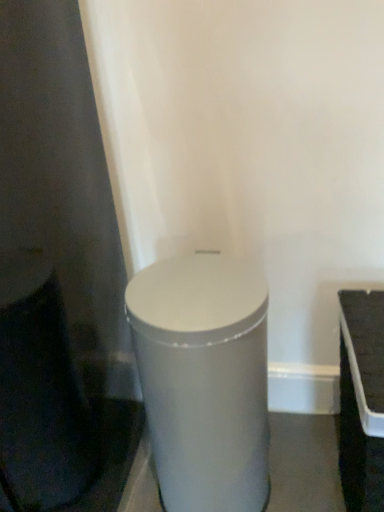
Locate an element on the screen. The height and width of the screenshot is (512, 384). satin silver cylinder at center is located at coordinates (204, 379).

This screenshot has height=512, width=384. Describe the element at coordinates (204, 379) in the screenshot. I see `satin silver cylinder at center` at that location.

The height and width of the screenshot is (512, 384). Describe the element at coordinates (362, 399) in the screenshot. I see `white plastic tray at right` at that location.

The image size is (384, 512). Find the location of `white plastic tray at right`. white plastic tray at right is located at coordinates (362, 399).

In order to face white plastic tray at right, should I rotate leftwards or rightwards?

To align with it, rotate right about 23.354°.

Where is `satin silver cylinder at center`? The image size is (384, 512). satin silver cylinder at center is located at coordinates (204, 379).

Can you confirm if white plastic tray at right is positioned to the left of satin silver cylinder at center?

No.

Is the position of white plastic tray at right less distant than that of satin silver cylinder at center?

Yes, the depth of white plastic tray at right is less than that of satin silver cylinder at center.

Is point (371, 297) farther from camera compared to point (207, 274)?

Yes.

From the image's perspective, is white plastic tray at right below satin silver cylinder at center?

Correct, white plastic tray at right appears lower than satin silver cylinder at center in the image.

From a real-world perspective, is white plastic tray at right physically above satin silver cylinder at center?

Incorrect, from a real-world perspective, white plastic tray at right is lower than satin silver cylinder at center.

From the picture: Considering the sizes of objects white plastic tray at right and satin silver cylinder at center in the image provided, who is thinner, white plastic tray at right or satin silver cylinder at center?

satin silver cylinder at center is thinner.

Considering the relative sizes of white plastic tray at right and satin silver cylinder at center in the image provided, is white plastic tray at right taller than satin silver cylinder at center?

Incorrect, the height of white plastic tray at right is not larger of that of satin silver cylinder at center.

Based on their sizes in the image, would you say white plastic tray at right is bigger or smaller than satin silver cylinder at center?

Considering their sizes, white plastic tray at right takes up less space than satin silver cylinder at center.

Is white plastic tray at right inside or outside of satin silver cylinder at center?

white plastic tray at right is spatially situated outside satin silver cylinder at center.

Is white plastic tray at right not close to satin silver cylinder at center?

No.

Is white plastic tray at right facing away from satin silver cylinder at center?

No, white plastic tray at right's orientation is not away from satin silver cylinder at center.

You are a GUI agent. You are given a task and a screenshot of the screen. Output one action in this format:
    pyautogui.click(x=<x>, y=<y>)
    Task: Click on the table that appears below the satin silver cylinder at center (from a real-world perspective)
    The width and height of the screenshot is (384, 512).
    Given the screenshot: What is the action you would take?
    pyautogui.click(x=362, y=399)

Looking at this image, would you say satin silver cylinder at center is to the left or to the right of white plastic tray at right in the picture?

From the image, it's evident that satin silver cylinder at center is to the left of white plastic tray at right.

Considering the positions of objects satin silver cylinder at center and white plastic tray at right in the image provided, who is behind, satin silver cylinder at center or white plastic tray at right?

satin silver cylinder at center is more distant.

Between point (144, 307) and point (356, 388), which one is positioned behind?

The point (144, 307) is farther from the camera.

From the image's perspective, does satin silver cylinder at center appear lower than white plastic tray at right?

No, from the image's perspective, satin silver cylinder at center is not beneath white plastic tray at right.

From a real-world perspective, who is located lower, satin silver cylinder at center or white plastic tray at right?

white plastic tray at right, from a real-world perspective.

Between satin silver cylinder at center and white plastic tray at right, which one has larger width?

white plastic tray at right.

Considering the relative sizes of satin silver cylinder at center and white plastic tray at right in the image provided, is satin silver cylinder at center shorter than white plastic tray at right?

In fact, satin silver cylinder at center may be taller than white plastic tray at right.

Considering the sizes of objects satin silver cylinder at center and white plastic tray at right in the image provided, who is smaller, satin silver cylinder at center or white plastic tray at right?

Smaller between the two is white plastic tray at right.

Can we say satin silver cylinder at center lies outside white plastic tray at right?

That's correct, satin silver cylinder at center is outside of white plastic tray at right.

Is satin silver cylinder at center next to white plastic tray at right and touching it?

No.

Based on the photo, could you tell me if satin silver cylinder at center is facing white plastic tray at right?

No, satin silver cylinder at center is not oriented towards white plastic tray at right.

Can you tell me how much satin silver cylinder at center and white plastic tray at right differ in facing direction?

The angle between the facing direction of satin silver cylinder at center and the facing direction of white plastic tray at right is 0.000338 degrees.

Measure the distance between satin silver cylinder at center and white plastic tray at right.

The distance of satin silver cylinder at center from white plastic tray at right is 27.64 centimeters.

I want to click on waste container that appears on the left of white plastic tray at right, so click(x=204, y=379).

I want to click on table on the right of the satin silver cylinder at center, so click(362, 399).

Find the location of a particular element. This screenshot has height=512, width=384. table located below the satin silver cylinder at center (from the image's perspective) is located at coordinates (362, 399).